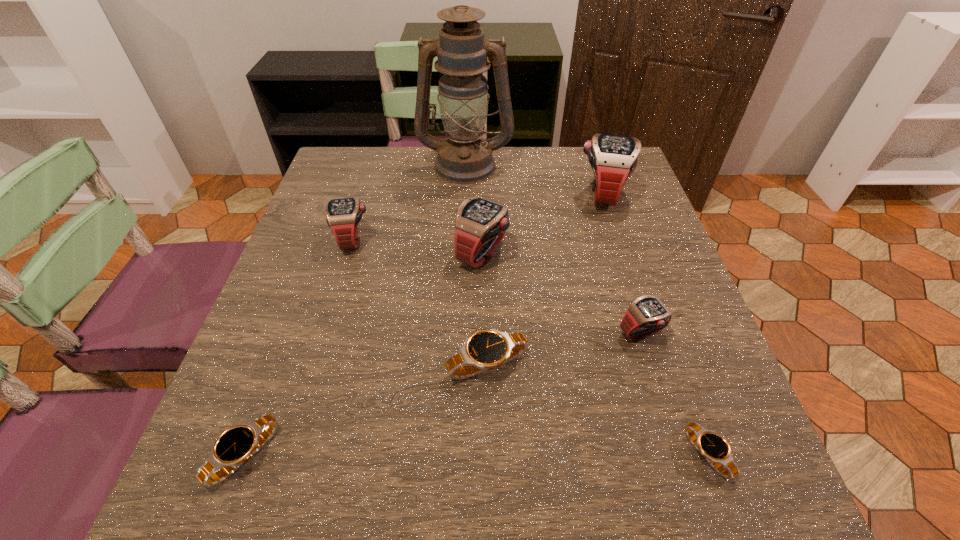
The height and width of the screenshot is (540, 960). In order to click on vacant space at the near edge of the desktop in this screenshot , I will do `click(608, 476)`.

Image resolution: width=960 pixels, height=540 pixels. In the image, there is a desktop. Identify the location of vacant space at the left edge. (290, 438).

I want to click on free space at the far left corner, so click(x=324, y=174).

Where is `vacant space at the near left corner of the desktop`? vacant space at the near left corner of the desktop is located at coordinates 242,523.

Find the location of a particular element. Image resolution: width=960 pixels, height=540 pixels. unoccupied area between the smallest red watch and the brown oil lamp is located at coordinates (554, 249).

Where is `free area in between the biggest red watch and the biggest black watch`? This screenshot has height=540, width=960. free area in between the biggest red watch and the biggest black watch is located at coordinates tap(544, 279).

Locate an element on the screen. The height and width of the screenshot is (540, 960). free area in between the rightmost black watch and the third shortest watch is located at coordinates (597, 409).

Where is `free space between the fourth tallest object and the shortest object`? Image resolution: width=960 pixels, height=540 pixels. free space between the fourth tallest object and the shortest object is located at coordinates (530, 347).

This screenshot has width=960, height=540. I want to click on free space between the oil lamp and the smallest black watch, so click(586, 309).

What are the coordinates of `free space between the smallest red watch and the second red watch from left to right` in the screenshot? It's located at (562, 293).